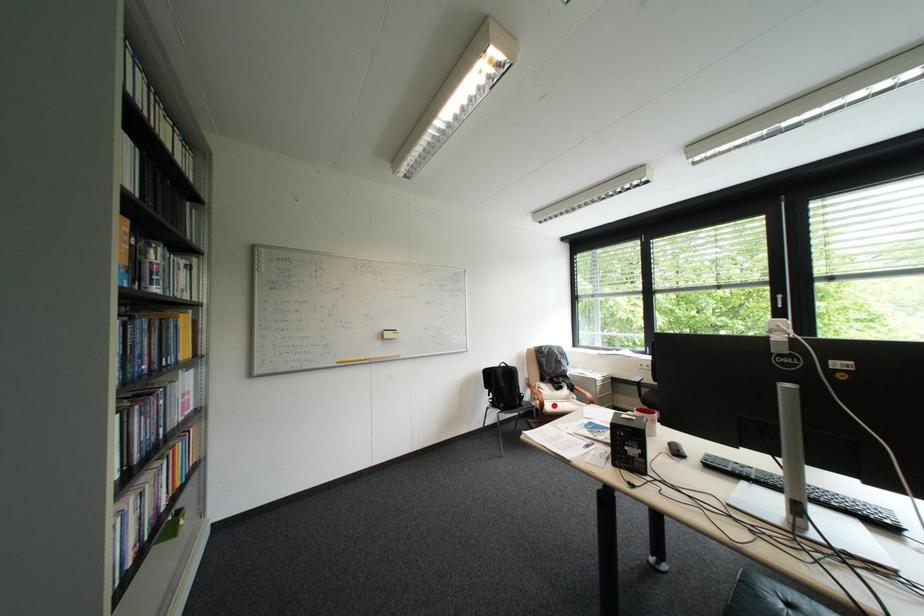
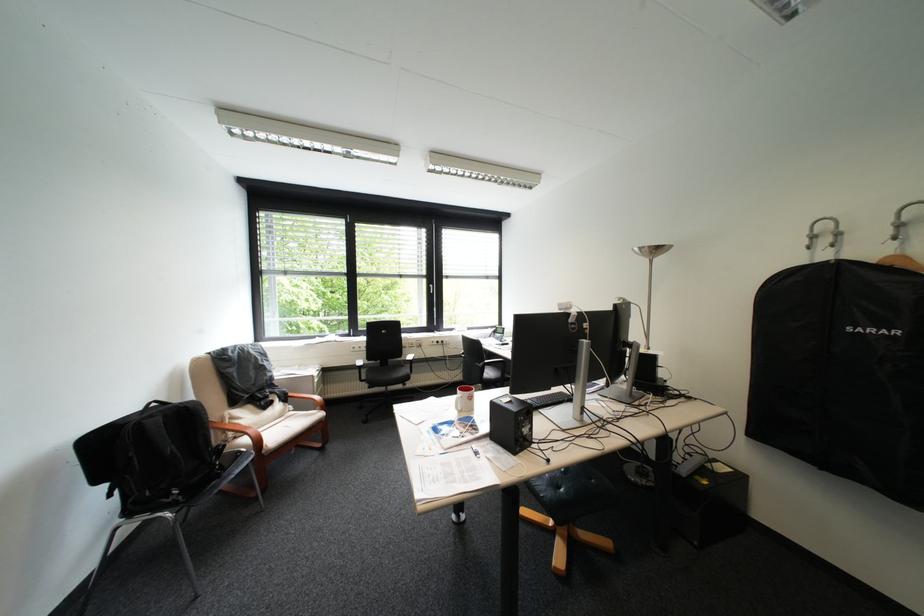
Where in the second image is the point corresponding to the highlighted location from the first image?

(271, 443)